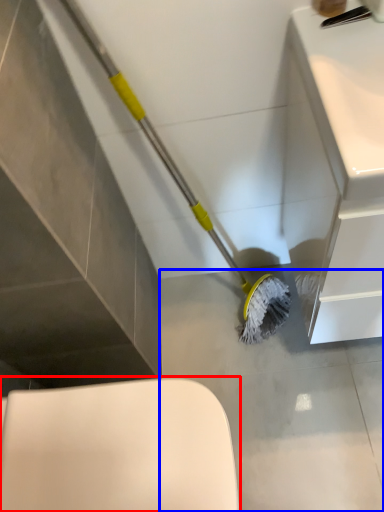
Question: Which point is closer to the camera, toilet (highlighted by a red box) or concrete (highlighted by a blue box)?

Choices:
 (A) toilet
 (B) concrete

Answer: (A)